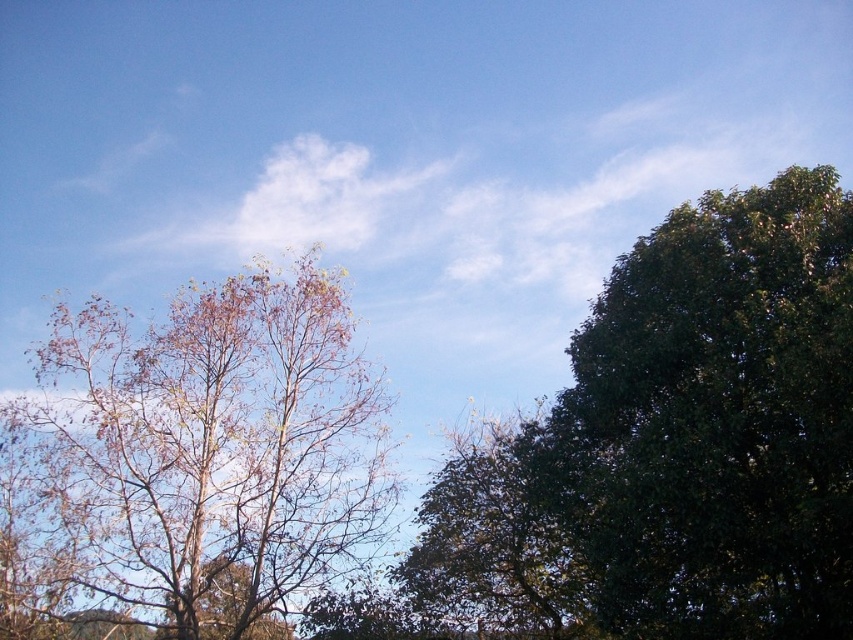
You are standing in the serene outdoor scene and want to take a photo of the green leafy tree at right. Based on its position, which direction should you face to ensure it is centered in your camera view?

The green leafy tree at right is located at point 0.661 on the x and 0.838 on the y coordinate, so you should face towards the right side of the scene to center it in your camera view.